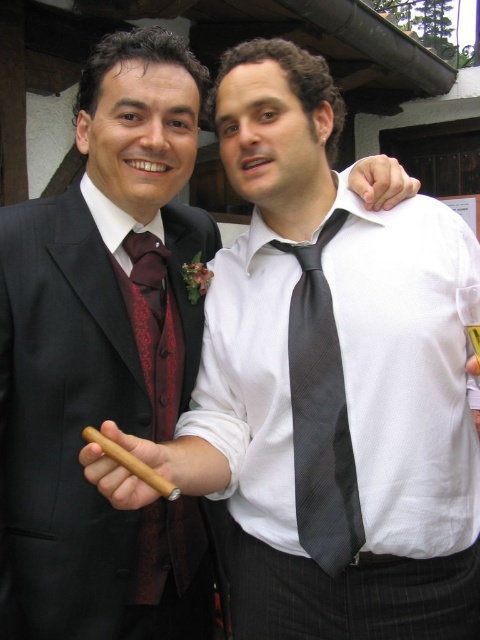
You are a photographer at a social event and need to adjust your camera focus. The black satin suit at left and the dark gray textured tie at center are in your frame. Which object should you focus on first if you want to capture the one closer to the camera?

The dark gray textured tie at center is closer to the camera than the black satin suit at left, so focus on the dark gray textured tie at center first.

Based on the photo, you are at a social event and need to take a photo of both men. The photographer tells you that the man at point (x=355, y=474) and the man at point (x=176, y=586) must be in the frame. Based on their positions, which man is closer to the camera?

The man at point (x=355, y=474) is closer to the camera because point (x=355, y=474) is in front of point (x=176, y=586).

You are at a social event and need to locate the black satin suit at left and the dark gray textured tie at center. From your perspective, which one is positioned to the left?

The black satin suit at left is positioned to the left of the dark gray textured tie at center.